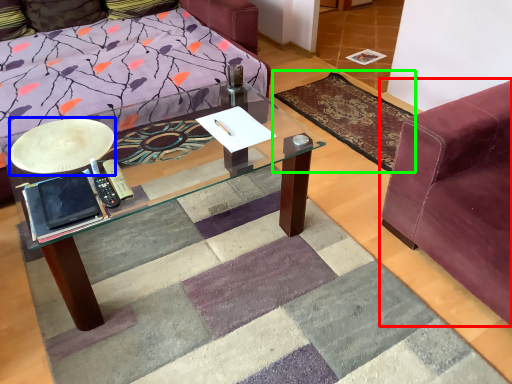
Question: Based on their relative distances, which object is farther from studio couch (highlighted by a red box)? Choose from round table (highlighted by a blue box) and mat (highlighted by a green box).

Choices:
 (A) round table
 (B) mat

Answer: (A)